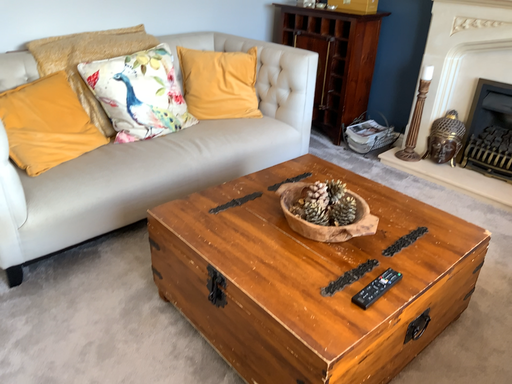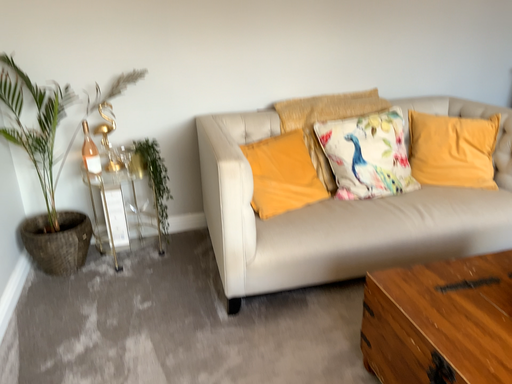
Question: Which way did the camera rotate in the video?

Choices:
 (A) rotated upward
 (B) rotated downward

Answer: (A)